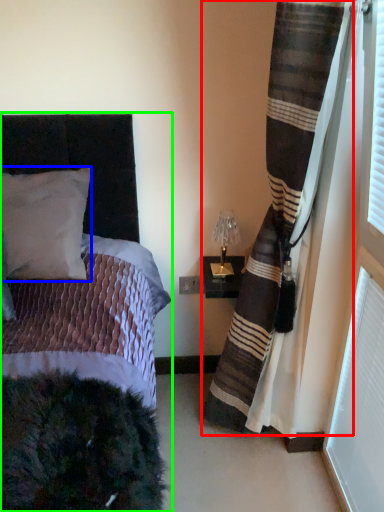
Question: Which object is the farthest from curtain (highlighted by a red box)? Choose among these: pillow (highlighted by a blue box) or bed (highlighted by a green box).

Choices:
 (A) pillow
 (B) bed

Answer: (A)